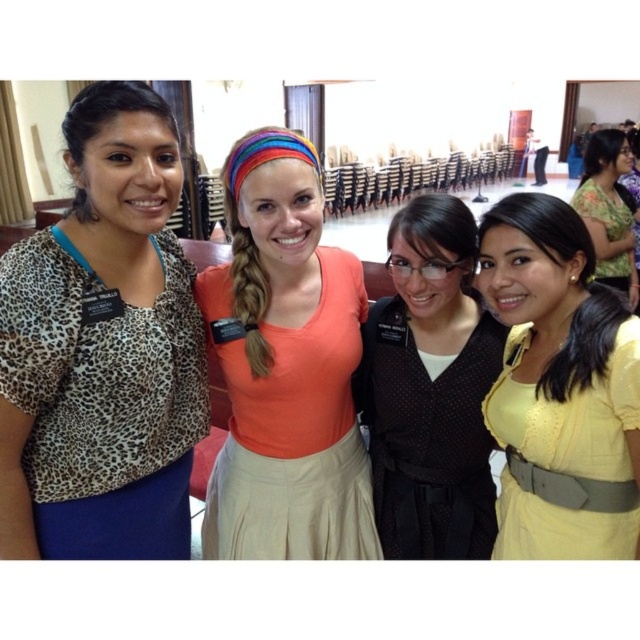
Question: Can you confirm if leopard print blouse at left is positioned below orange matte shirt at center?

Choices:
 (A) yes
 (B) no

Answer: (B)

Question: Does yellow matte dress at center have a greater width compared to matte black vest at center?

Choices:
 (A) no
 (B) yes

Answer: (A)

Question: Considering the relative positions of leopard print blouse at left and orange matte shirt at center in the image provided, where is leopard print blouse at left located with respect to orange matte shirt at center?

Choices:
 (A) left
 (B) right

Answer: (A)

Question: Estimate the real-world distances between objects in this image. Which object is farther from the matte black vest at center?

Choices:
 (A) leopard print blouse at left
 (B) orange matte shirt at center
 (C) yellow matte dress at center
 (D) floral fabric dress at upper right

Answer: (D)

Question: Which of the following is the farthest from the observer?

Choices:
 (A) matte black vest at center
 (B) floral fabric dress at upper right

Answer: (B)

Question: Which of the following is the closest to the observer?

Choices:
 (A) (524, 253)
 (B) (74, 547)
 (C) (625, 228)
 (D) (230, 232)

Answer: (B)